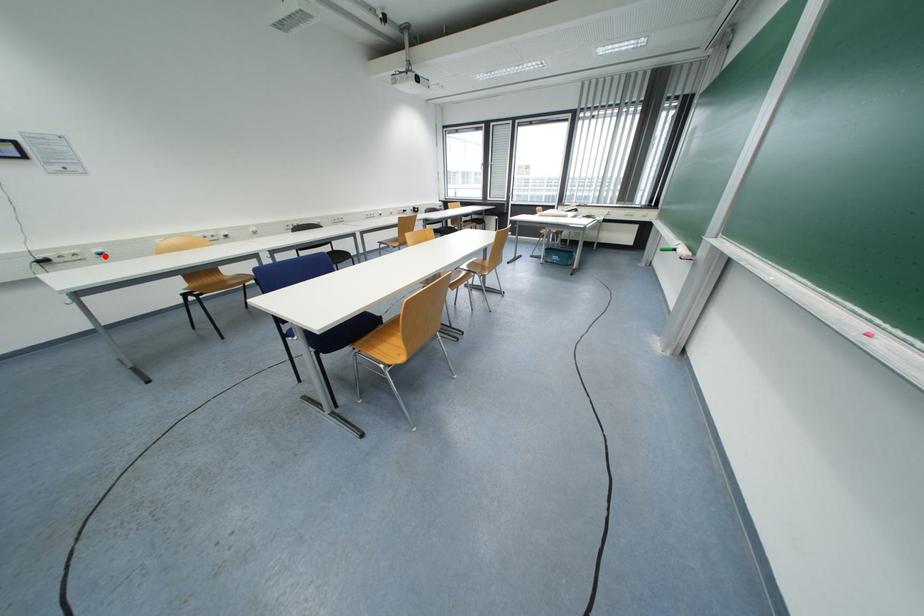
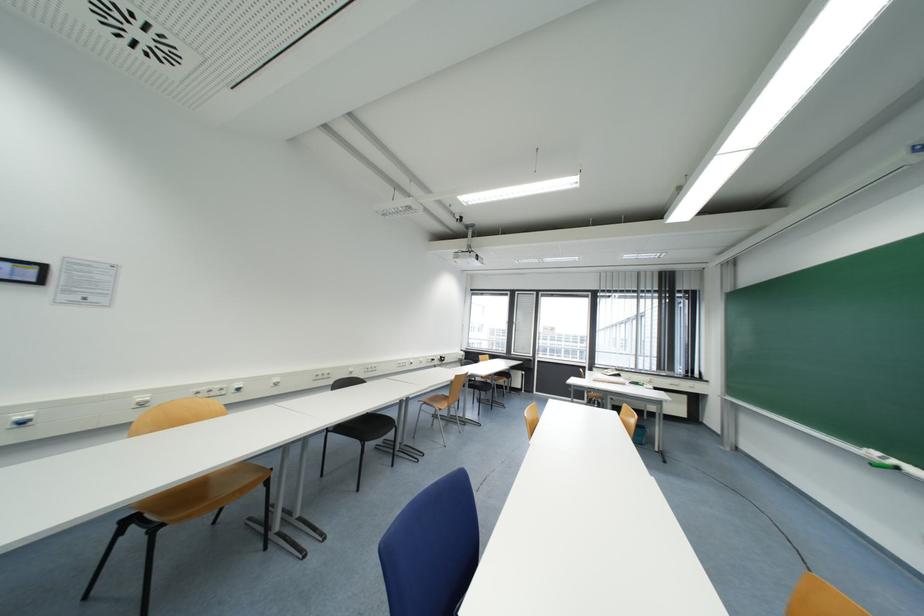
Locate, in the second image, the point that corresponds to the highlighted location in the first image.

(28, 424)